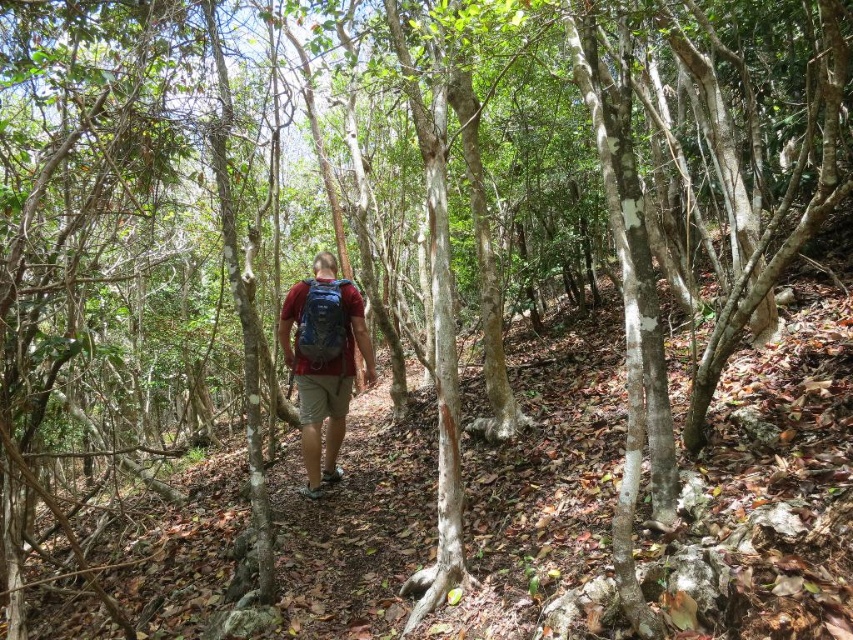
Can you confirm if matte blue backpack at center is wider than blue fabric backpack at center?

Correct, the width of matte blue backpack at center exceeds that of blue fabric backpack at center.

Can you confirm if matte blue backpack at center is positioned to the left of blue fabric backpack at center?

Indeed, matte blue backpack at center is positioned on the left side of blue fabric backpack at center.

Is point (331, 474) in front of point (299, 349)?

No.

The width and height of the screenshot is (853, 640). Identify the location of matte blue backpack at center. (323, 365).